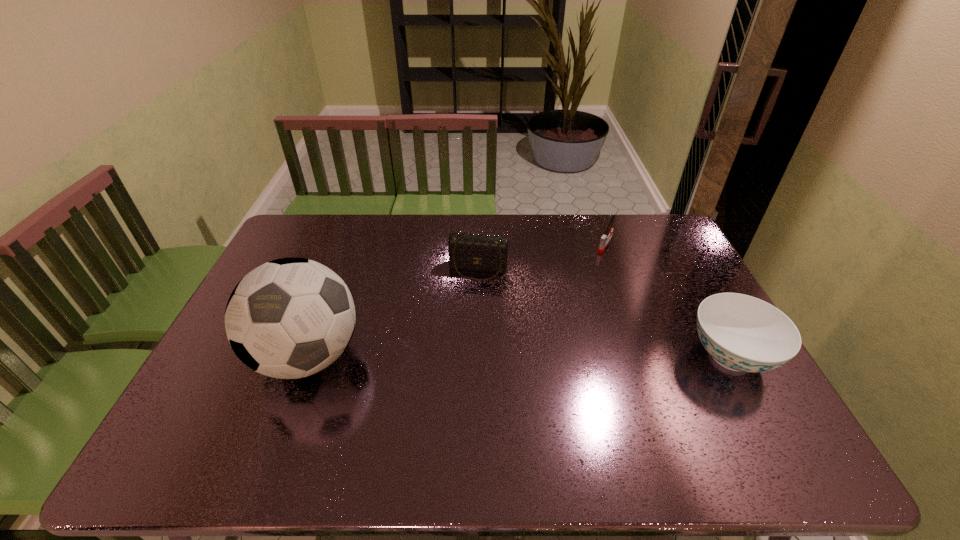
Where is `blank region between the chinaware and the leftmost object`? This screenshot has height=540, width=960. blank region between the chinaware and the leftmost object is located at coordinates (519, 356).

Find the location of a particular element. Image resolution: width=960 pixels, height=540 pixels. vacant space in between the shortest object and the leftmost object is located at coordinates (457, 300).

At what (x,y) coordinates should I click in order to perform the action: click on free space between the chinaware and the second object from right to left. Please return your answer as a coordinate pair (x, y). The height and width of the screenshot is (540, 960). Looking at the image, I should click on (668, 300).

At what (x,y) coordinates should I click in order to perform the action: click on free spot between the second object from right to left and the leftmost object. Please return your answer as a coordinate pair (x, y). The width and height of the screenshot is (960, 540). Looking at the image, I should click on (457, 300).

Image resolution: width=960 pixels, height=540 pixels. I want to click on unoccupied position between the leftmost object and the clutch bag, so click(x=394, y=313).

At what (x,y) coordinates should I click in order to perform the action: click on free spot between the leftmost object and the chinaware. Please return your answer as a coordinate pair (x, y). This screenshot has height=540, width=960. Looking at the image, I should click on (519, 356).

The height and width of the screenshot is (540, 960). Identify the location of free space between the farthest object and the second farthest object. (542, 256).

Find the location of `object identified as the closest to the soccer ball`. object identified as the closest to the soccer ball is located at coordinates (476, 252).

Where is `object that stands as the third closest to the leftmost object`? This screenshot has width=960, height=540. object that stands as the third closest to the leftmost object is located at coordinates (742, 333).